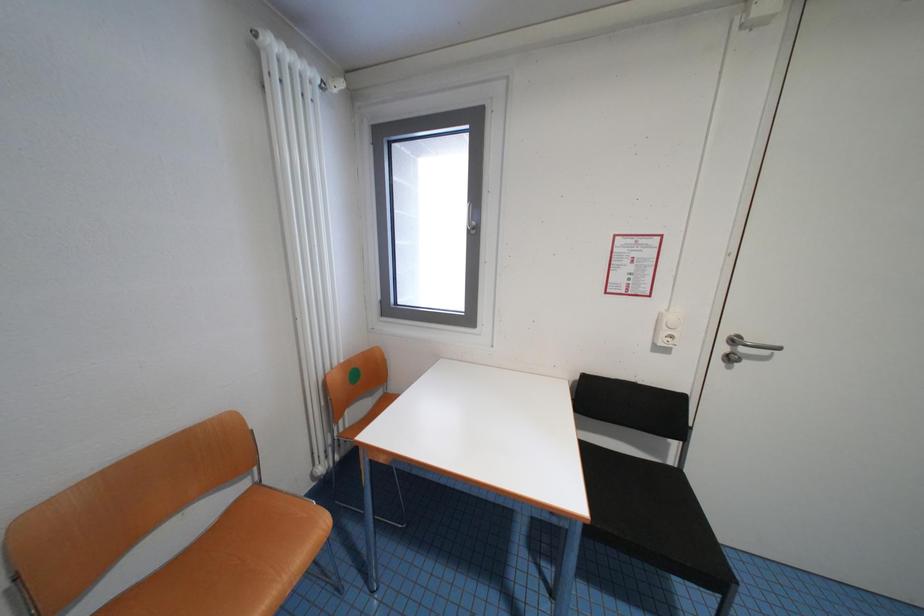
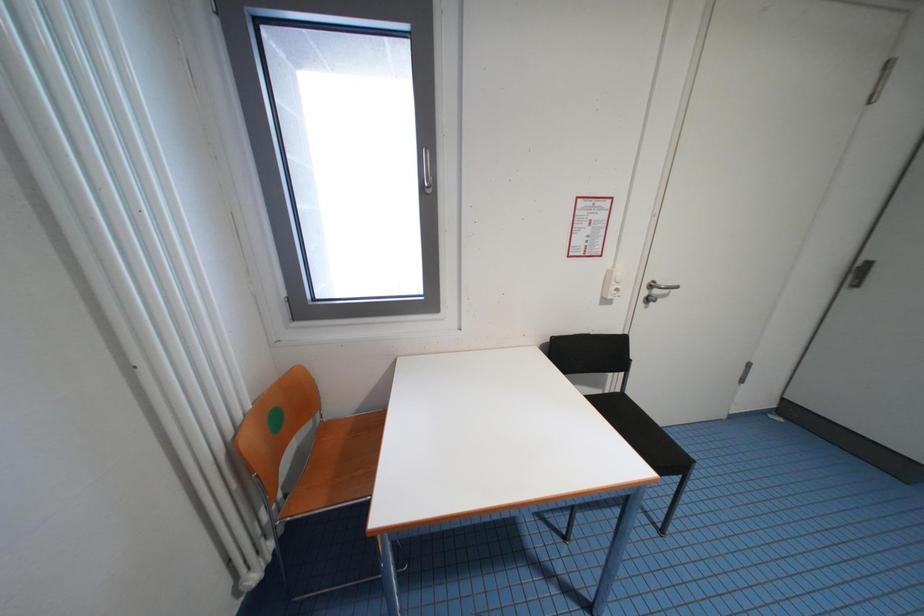
The images are taken continuously from a first-person perspective. In which direction are you moving?

The movement direction of the cameraman is left, forward.